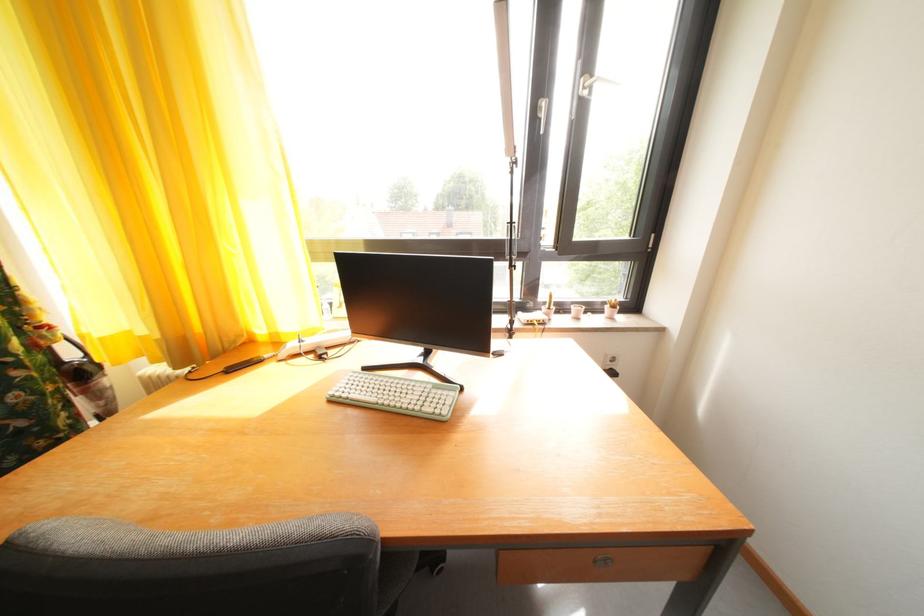
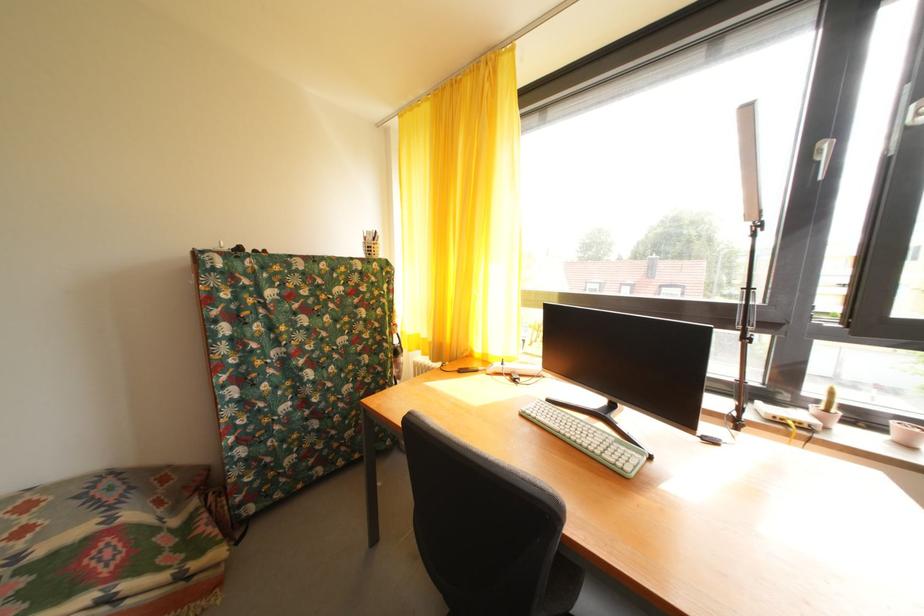
In the second image, find the point that corresponds to point 152,345 in the first image.

(432, 346)